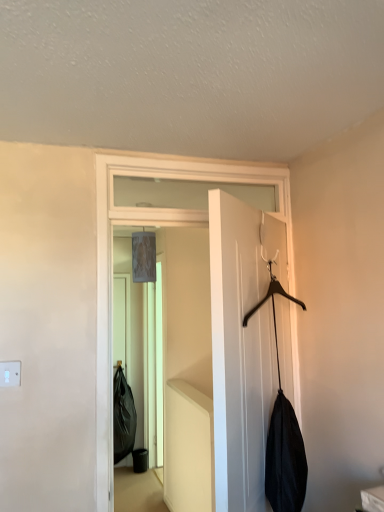
What do you see at coordinates (242, 347) in the screenshot?
I see `white matte door at center, placed as the second door when sorted from back to front` at bounding box center [242, 347].

You are a GUI agent. You are given a task and a screenshot of the screen. Output one action in this format:
    pyautogui.click(x=<x>, y=<y>)
    Task: Click on the white matte door at center, which is the 1th door in front-to-back order
    Image resolution: width=384 pixels, height=512 pixels.
    Given the screenshot: What is the action you would take?
    pyautogui.click(x=242, y=347)

Looking at this image, in order to face white matte door at center, placed as the 2th door when sorted from front to back, should I rotate leftwards or rightwards?

Rotate your view right by about 1.735°.

This screenshot has height=512, width=384. Describe the element at coordinates (155, 225) in the screenshot. I see `white matte door at center, the first door in the back-to-front sequence` at that location.

Where is `white matte door at center, placed as the 2th door when sorted from front to back`? This screenshot has width=384, height=512. white matte door at center, placed as the 2th door when sorted from front to back is located at coordinates (155, 225).

Image resolution: width=384 pixels, height=512 pixels. Identify the location of white matte door at center, which is the 1th door in front-to-back order. (242, 347).

Is white matte door at center, which is the 1th door in front-to-back order, to the left or to the right of white matte door at center, placed as the 2th door when sorted from front to back, in the image?

white matte door at center, which is the 1th door in front-to-back order, is positioned on white matte door at center, placed as the 2th door when sorted from front to back,'s right side.

Does white matte door at center, placed as the second door when sorted from back to front, come in front of white matte door at center, placed as the 2th door when sorted from front to back?

Yes, white matte door at center, placed as the second door when sorted from back to front, is closer to the camera.

Considering the positions of point (268, 281) and point (105, 426), is point (268, 281) closer or farther from the camera than point (105, 426)?

Point (268, 281) is positioned farther from the camera compared to point (105, 426).

From the image's perspective, relative to white matte door at center, the first door in the back-to-front sequence, is white matte door at center, placed as the second door when sorted from back to front, above or below?

Clearly, from the image's perspective, white matte door at center, placed as the second door when sorted from back to front, is below white matte door at center, the first door in the back-to-front sequence.

From a real-world perspective, is white matte door at center, placed as the second door when sorted from back to front, on top of white matte door at center, the first door in the back-to-front sequence?

No, from a real-world perspective, white matte door at center, placed as the second door when sorted from back to front, is not over white matte door at center, the first door in the back-to-front sequence

Which object is thinner, white matte door at center, which is the 1th door in front-to-back order, or white matte door at center, placed as the 2th door when sorted from front to back?

white matte door at center, placed as the 2th door when sorted from front to back.

Is white matte door at center, which is the 1th door in front-to-back order, taller or shorter than white matte door at center, the first door in the back-to-front sequence?

Considering their sizes, white matte door at center, which is the 1th door in front-to-back order, has less height than white matte door at center, the first door in the back-to-front sequence.

Can you confirm if white matte door at center, placed as the second door when sorted from back to front, is smaller than white matte door at center, the first door in the back-to-front sequence?

Actually, white matte door at center, placed as the second door when sorted from back to front, might be larger than white matte door at center, the first door in the back-to-front sequence.

In the scene shown: Does white matte door at center, which is the 1th door in front-to-back order, contain white matte door at center, placed as the 2th door when sorted from front to back?

No, white matte door at center, placed as the 2th door when sorted from front to back, is not inside white matte door at center, which is the 1th door in front-to-back order.

Is white matte door at center, placed as the second door when sorted from back to front, placed right next to white matte door at center, the first door in the back-to-front sequence?

white matte door at center, placed as the second door when sorted from back to front, is not next to white matte door at center, the first door in the back-to-front sequence, and they're not touching.

Could you tell me if white matte door at center, placed as the second door when sorted from back to front, is facing white matte door at center, placed as the 2th door when sorted from front to back?

Yes, white matte door at center, placed as the second door when sorted from back to front, is oriented towards white matte door at center, placed as the 2th door when sorted from front to back.

What's the angular difference between white matte door at center, which is the 1th door in front-to-back order, and white matte door at center, placed as the 2th door when sorted from front to back,'s facing directions?

white matte door at center, which is the 1th door in front-to-back order, and white matte door at center, placed as the 2th door when sorted from front to back, are facing 137 degrees away from each other.

Measure the distance from white matte door at center, which is the 1th door in front-to-back order, to white matte door at center, placed as the 2th door when sorted from front to back.

47.03 centimeters.

This screenshot has width=384, height=512. Find the location of `door on the left of white matte door at center, which is the 1th door in front-to-back order`. door on the left of white matte door at center, which is the 1th door in front-to-back order is located at coordinates (155, 225).

Looking at this image, does white matte door at center, the first door in the back-to-front sequence, appear on the left side of white matte door at center, placed as the second door when sorted from back to front?

Yes, white matte door at center, the first door in the back-to-front sequence, is to the left of white matte door at center, placed as the second door when sorted from back to front.

Which object is further away from the camera, white matte door at center, placed as the 2th door when sorted from front to back, or white matte door at center, which is the 1th door in front-to-back order?

white matte door at center, placed as the 2th door when sorted from front to back, is further away from the camera.

Which is behind, point (101, 259) or point (217, 328)?

Positioned behind is point (101, 259).

From the image's perspective, which is below, white matte door at center, the first door in the back-to-front sequence, or white matte door at center, placed as the second door when sorted from back to front?

white matte door at center, placed as the second door when sorted from back to front, is shown below in the image.

From a real-world perspective, between white matte door at center, placed as the 2th door when sorted from front to back, and white matte door at center, which is the 1th door in front-to-back order, who is vertically lower?

white matte door at center, which is the 1th door in front-to-back order.

Which object is wider, white matte door at center, placed as the 2th door when sorted from front to back, or white matte door at center, placed as the second door when sorted from back to front?

white matte door at center, placed as the second door when sorted from back to front, is wider.

Between white matte door at center, placed as the 2th door when sorted from front to back, and white matte door at center, which is the 1th door in front-to-back order, which one has more height?

Standing taller between the two is white matte door at center, placed as the 2th door when sorted from front to back.

Considering the sizes of objects white matte door at center, the first door in the back-to-front sequence, and white matte door at center, placed as the second door when sorted from back to front, in the image provided, who is bigger, white matte door at center, the first door in the back-to-front sequence, or white matte door at center, placed as the second door when sorted from back to front,?

With larger size is white matte door at center, placed as the second door when sorted from back to front.

Is white matte door at center, the first door in the back-to-front sequence, inside the boundaries of white matte door at center, placed as the second door when sorted from back to front, or outside?

white matte door at center, the first door in the back-to-front sequence, lies outside white matte door at center, placed as the second door when sorted from back to front.

Does white matte door at center, placed as the 2th door when sorted from front to back, touch white matte door at center, which is the 1th door in front-to-back order?

No, white matte door at center, placed as the 2th door when sorted from front to back, is not beside white matte door at center, which is the 1th door in front-to-back order.

Is white matte door at center, the first door in the back-to-front sequence, oriented towards white matte door at center, which is the 1th door in front-to-back order?

Yes, white matte door at center, the first door in the back-to-front sequence, faces towards white matte door at center, which is the 1th door in front-to-back order.

Where is `door lying in front of the white matte door at center, the first door in the back-to-front sequence`? This screenshot has width=384, height=512. door lying in front of the white matte door at center, the first door in the back-to-front sequence is located at coordinates (242, 347).

Image resolution: width=384 pixels, height=512 pixels. In order to click on door on the left of the white matte door at center, which is the 1th door in front-to-back order in this screenshot , I will do `click(155, 225)`.

Locate an element on the screen. door on the right of white matte door at center, placed as the 2th door when sorted from front to back is located at coordinates (242, 347).